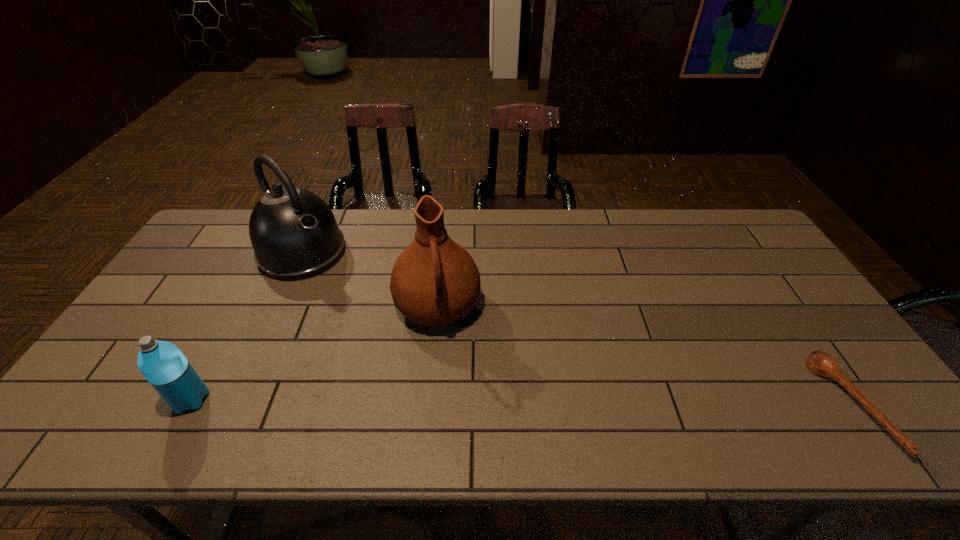
Find the location of a particular element. vacant space at the right edge is located at coordinates (745, 274).

This screenshot has height=540, width=960. What are the coordinates of `free space at the far left corner of the desktop` in the screenshot? It's located at (222, 249).

I want to click on vacant space at the far right corner of the desktop, so click(707, 217).

The image size is (960, 540). In order to click on vacant area that lies between the pitcher and the kettle in this screenshot , I will do `click(370, 280)`.

Locate an element on the screen. This screenshot has width=960, height=540. free space that is in between the thermos bottle and the kettle is located at coordinates click(247, 327).

Identify the location of vacant area between the rightmost object and the kettle. The width and height of the screenshot is (960, 540). (576, 329).

This screenshot has height=540, width=960. I want to click on free space that is in between the shortest object and the third tallest object, so click(x=520, y=402).

Find the location of a particular element. free area in between the kettle and the third tallest object is located at coordinates (247, 327).

Identify the location of vacant region between the pitcher and the kettle. (370, 280).

Image resolution: width=960 pixels, height=540 pixels. What are the coordinates of `vacant space in between the kettle and the second shortest object` in the screenshot? It's located at (247, 327).